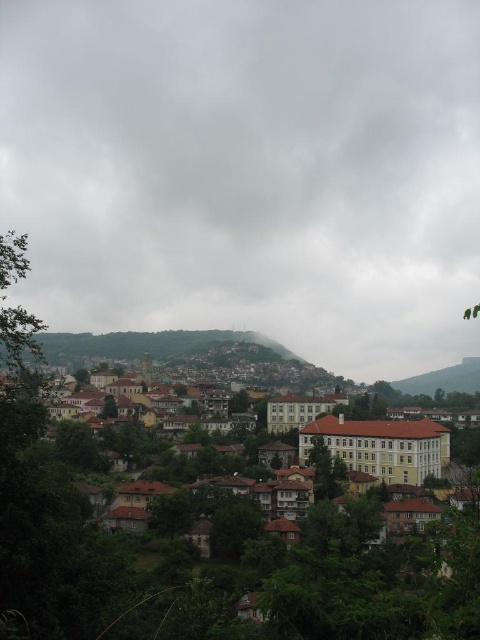
Question: Which of the following is the farthest from the observer?

Choices:
 (A) cloudy gray sky at upper center
 (B) brown wooden houses at lower center

Answer: (A)

Question: Is cloudy gray sky at upper center to the left of brown wooden houses at lower center from the viewer's perspective?

Choices:
 (A) no
 (B) yes

Answer: (B)

Question: Which point is closer to the camera taking this photo?

Choices:
 (A) (116, 102)
 (B) (12, 483)

Answer: (B)

Question: Does cloudy gray sky at upper center have a larger size compared to brown wooden houses at lower center?

Choices:
 (A) yes
 (B) no

Answer: (A)

Question: Which point is farther to the camera?

Choices:
 (A) (429, 426)
 (B) (250, 180)

Answer: (B)

Question: Can you confirm if cloudy gray sky at upper center is positioned to the left of brown wooden houses at lower center?

Choices:
 (A) yes
 (B) no

Answer: (A)